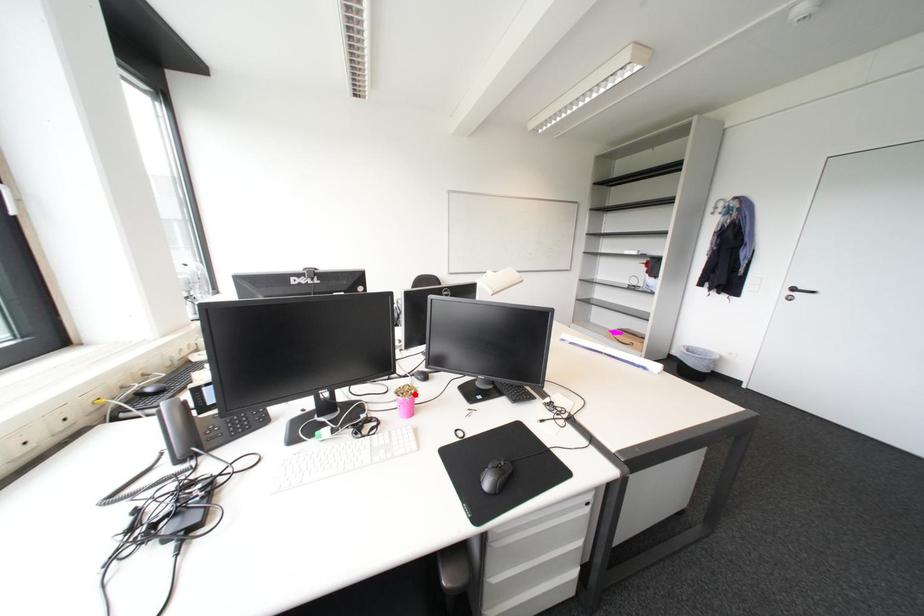
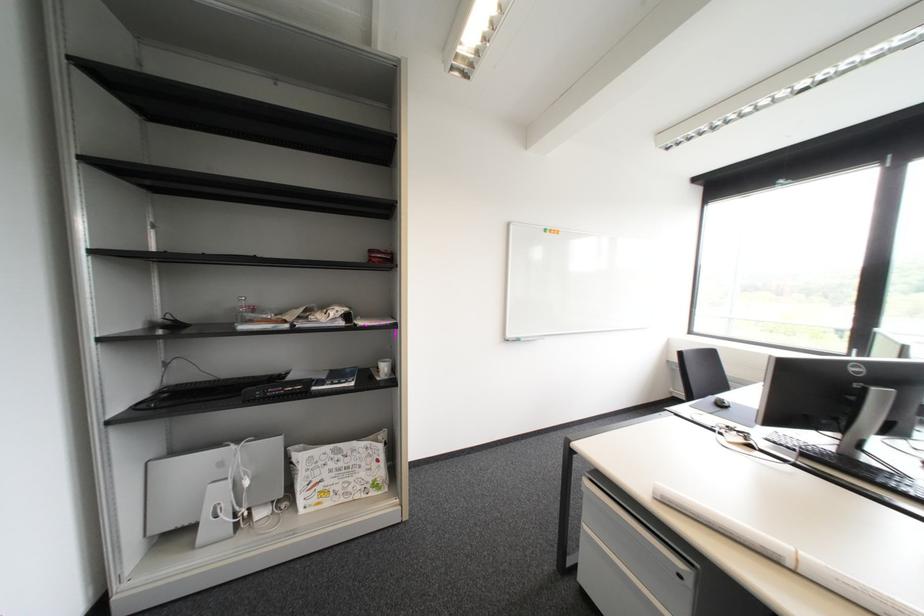
Question: I am providing you with two images of the same scene from different viewpoints. A red point is marked on the first image. At the location where the point appears in image 1, is it still visible in image 2?

Choices:
 (A) Yes
 (B) No

Answer: (B)